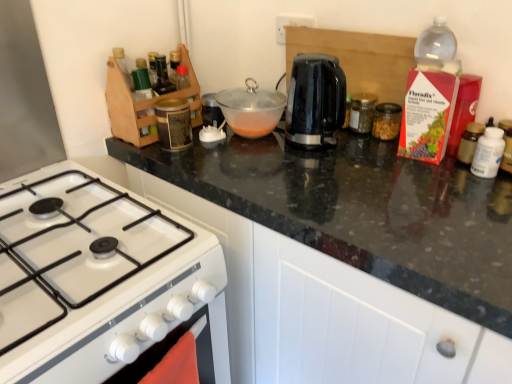
Locate an element on the screen. free space in front of transparent glass bowl at center, positioned as the 1th kitchen appliance in left-to-right order is located at coordinates (257, 155).